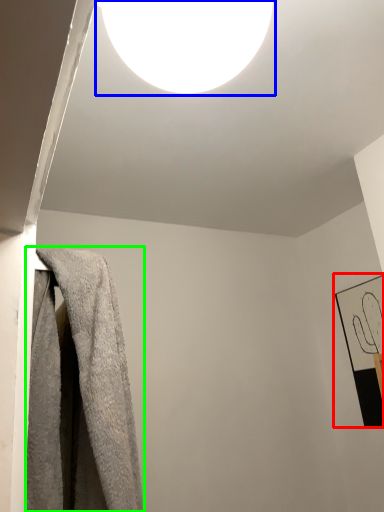
Question: Which is farther away from picture frame (highlighted by a red box)? lamp (highlighted by a blue box) or towel (highlighted by a green box)?

Choices:
 (A) lamp
 (B) towel

Answer: (A)